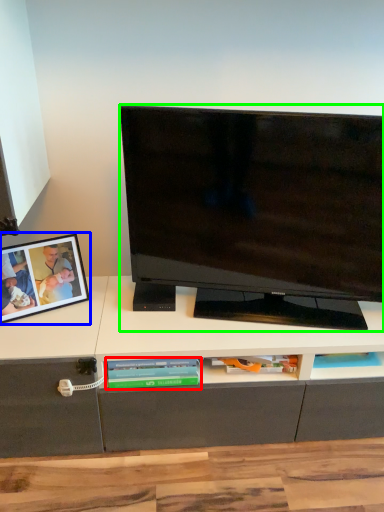
Question: Estimate the real-world distances between objects in this image. Which object is closer to book (highlighted by a red box), picture frame (highlighted by a blue box) or television (highlighted by a green box)?

Choices:
 (A) picture frame
 (B) television

Answer: (A)